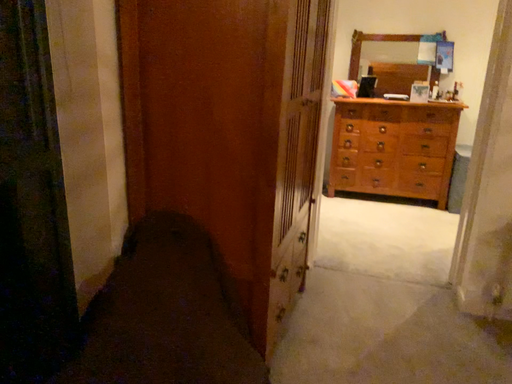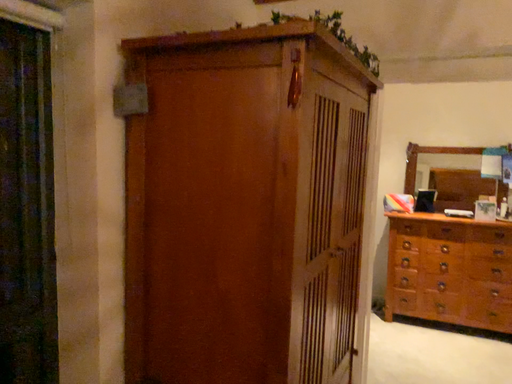
Question: How did the camera likely rotate when shooting the video?

Choices:
 (A) rotated right
 (B) rotated left

Answer: (B)